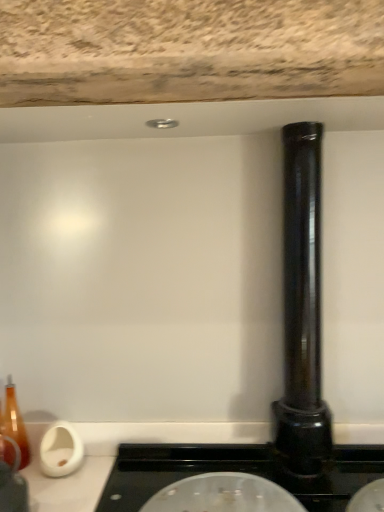
Question: Can you see black glossy pipe at right touching transparent glass lid at center?

Choices:
 (A) no
 (B) yes

Answer: (A)

Question: Is black glossy pipe at right behind transparent glass lid at center?

Choices:
 (A) yes
 (B) no

Answer: (A)

Question: Is black glossy pipe at right looking in the opposite direction of transparent glass lid at center?

Choices:
 (A) yes
 (B) no

Answer: (B)

Question: From a real-world perspective, is black glossy pipe at right below transparent glass lid at center?

Choices:
 (A) yes
 (B) no

Answer: (B)

Question: Considering the relative positions of black glossy pipe at right and transparent glass lid at center in the image provided, is black glossy pipe at right to the right of transparent glass lid at center from the viewer's perspective?

Choices:
 (A) yes
 (B) no

Answer: (A)

Question: Does black glossy pipe at right come in front of transparent glass lid at center?

Choices:
 (A) no
 (B) yes

Answer: (A)

Question: Is black glossy pipe at right completely or partially inside transparent glass lid at center?

Choices:
 (A) yes
 (B) no

Answer: (B)

Question: From the image's perspective, is transparent glass lid at center located above black glossy pipe at right?

Choices:
 (A) yes
 (B) no

Answer: (B)

Question: Does transparent glass lid at center have a greater width compared to black glossy pipe at right?

Choices:
 (A) no
 (B) yes

Answer: (B)

Question: Can we say transparent glass lid at center lies outside black glossy pipe at right?

Choices:
 (A) yes
 (B) no

Answer: (A)

Question: From a real-world perspective, is transparent glass lid at center on black glossy pipe at right?

Choices:
 (A) yes
 (B) no

Answer: (B)

Question: Is transparent glass lid at center closer to the viewer compared to black glossy pipe at right?

Choices:
 (A) yes
 (B) no

Answer: (A)

Question: Looking at the image, does black glossy pipe at right seem bigger or smaller compared to transparent glass lid at center?

Choices:
 (A) small
 (B) big

Answer: (B)